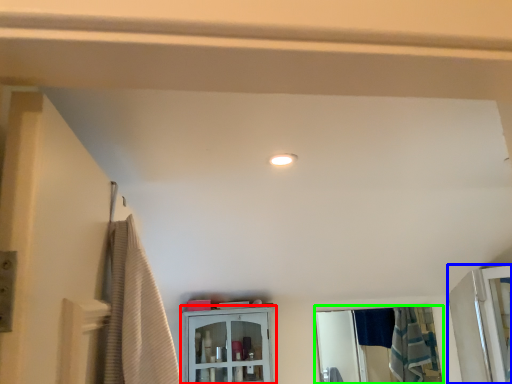
Question: Considering the real-world distances, which object is farthest from cabinetry (highlighted by a red box)? screen door (highlighted by a blue box) or mirror (highlighted by a green box)?

Choices:
 (A) screen door
 (B) mirror

Answer: (B)